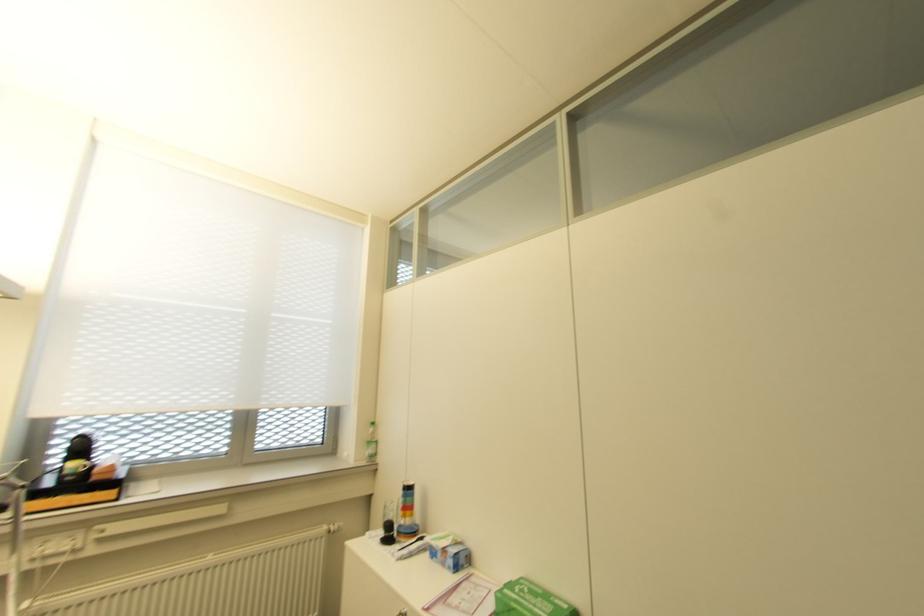
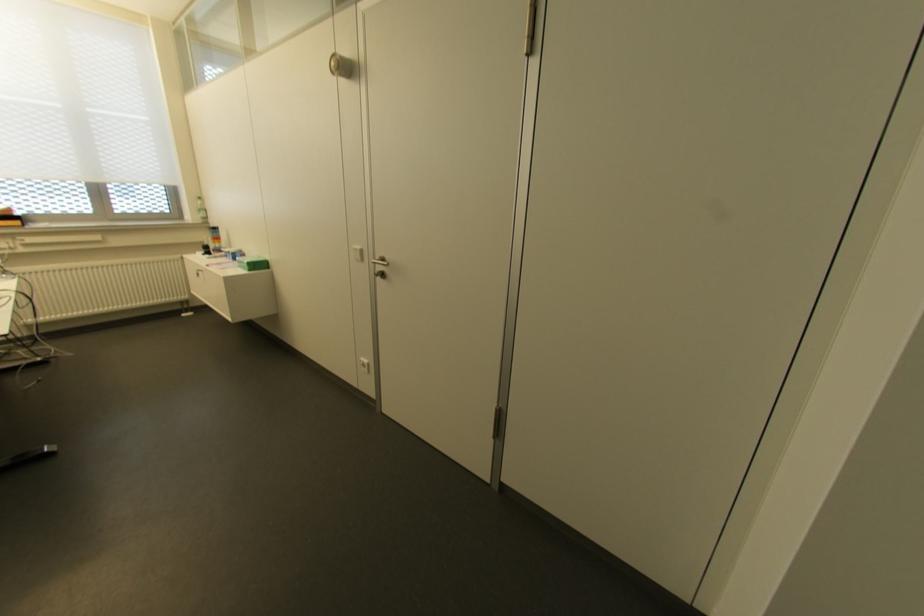
In the second image, find the point that corresponds to point 402,517 in the first image.

(213, 243)